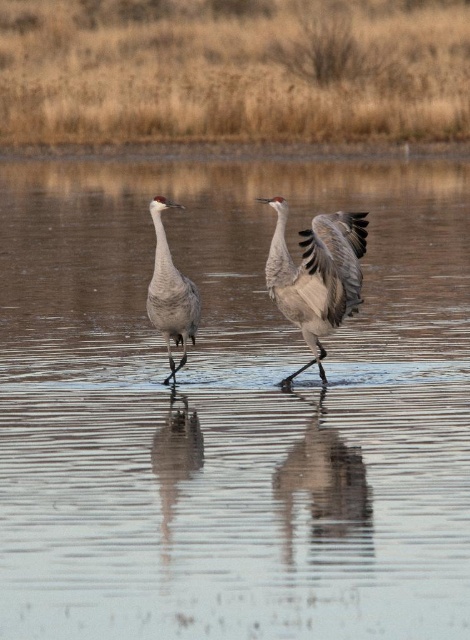
Between gray feathered crane at center and gray matte goose at center, which one appears on the left side from the viewer's perspective?

From the viewer's perspective, gray matte goose at center appears more on the left side.

Can you confirm if gray feathered crane at center is taller than gray matte goose at center?

Yes, gray feathered crane at center is taller than gray matte goose at center.

What do you see at coordinates (316, 275) in the screenshot? The width and height of the screenshot is (470, 640). I see `gray feathered crane at center` at bounding box center [316, 275].

The height and width of the screenshot is (640, 470). I want to click on gray feathered crane at center, so click(316, 275).

The height and width of the screenshot is (640, 470). Describe the element at coordinates (233, 70) in the screenshot. I see `brown grass at upper center` at that location.

Which is above, brown grass at upper center or gray feathered crane at center?

brown grass at upper center is above.

The height and width of the screenshot is (640, 470). In order to click on brown grass at upper center in this screenshot , I will do pyautogui.click(x=233, y=70).

Between point (5, 12) and point (149, 296), which one is positioned behind?

The point (5, 12) is more distant.

Is point (181, 112) positioned behind point (182, 321)?

Yes, point (181, 112) is behind point (182, 321).

The width and height of the screenshot is (470, 640). What are the coordinates of `brown grass at upper center` in the screenshot? It's located at (233, 70).